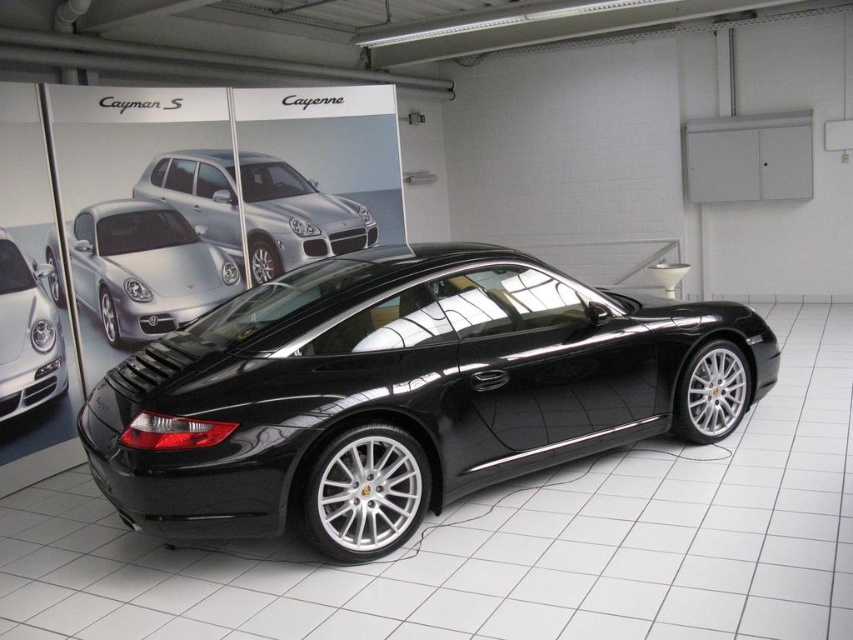
Question: Where is glossy black sports car at center located in relation to satin silver suv at center in the image?

Choices:
 (A) left
 (B) right

Answer: (B)

Question: Which of the following is the farthest from the observer?

Choices:
 (A) glossy black sports car at center
 (B) satin silver suv at center
 (C) satin silver headlight at center
 (D) shiny silver sedan at center

Answer: (B)

Question: Can you confirm if shiny silver sedan at center is positioned above satin silver suv at center?

Choices:
 (A) yes
 (B) no

Answer: (B)

Question: Which of the following is the closest to the observer?

Choices:
 (A) satin silver suv at center
 (B) glossy black sports car at center

Answer: (B)

Question: Does glossy black sports car at center have a greater width compared to satin silver headlight at center?

Choices:
 (A) yes
 (B) no

Answer: (A)

Question: Which object is the closest to the satin silver headlight at center?

Choices:
 (A) satin silver suv at center
 (B) shiny silver sedan at center

Answer: (B)